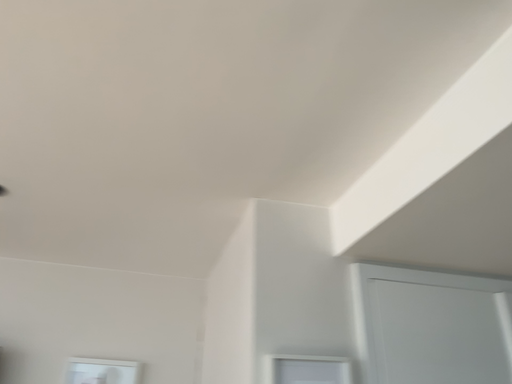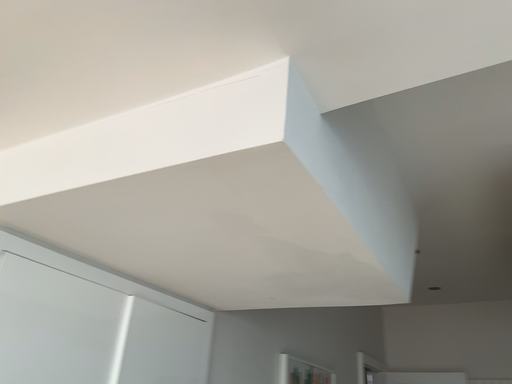
Question: Which way did the camera rotate in the video?

Choices:
 (A) rotated upward
 (B) rotated downward

Answer: (B)